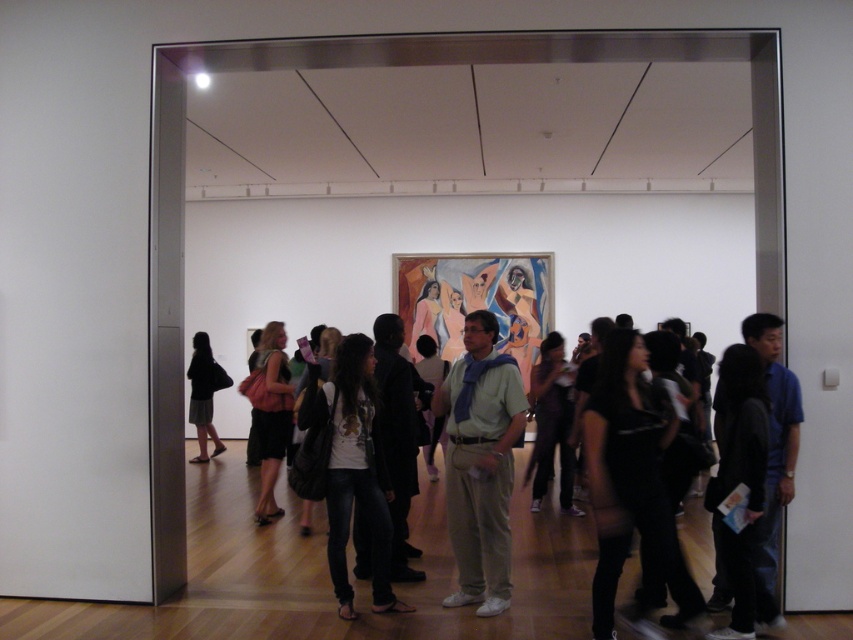
Is light green cotton shirt at center shorter than black fabric bag at left?

In fact, light green cotton shirt at center may be taller than black fabric bag at left.

Which is behind, point (450, 435) or point (196, 440)?

Point (196, 440)

The width and height of the screenshot is (853, 640). Identify the location of light green cotton shirt at center. (480, 464).

Is point (785, 634) less distant than point (483, 532)?

Yes, point (785, 634) is closer to viewer.

Who is taller, jeans at center or light green cotton shirt at center?

light green cotton shirt at center is taller.

You are a GUI agent. You are given a task and a screenshot of the screen. Output one action in this format:
    pyautogui.click(x=<x>, y=<y>)
    Task: Click on the jeans at center
    
    Given the screenshot: What is the action you would take?
    pyautogui.click(x=366, y=582)

Who is positioned more to the right, white cotton shirt at center or black fabric bag at left?

white cotton shirt at center

Measure the distance between point (340, 392) and camera.

The distance of point (340, 392) from camera is 3.70 meters.

The width and height of the screenshot is (853, 640). In order to click on white cotton shirt at center in this screenshot , I will do `click(352, 468)`.